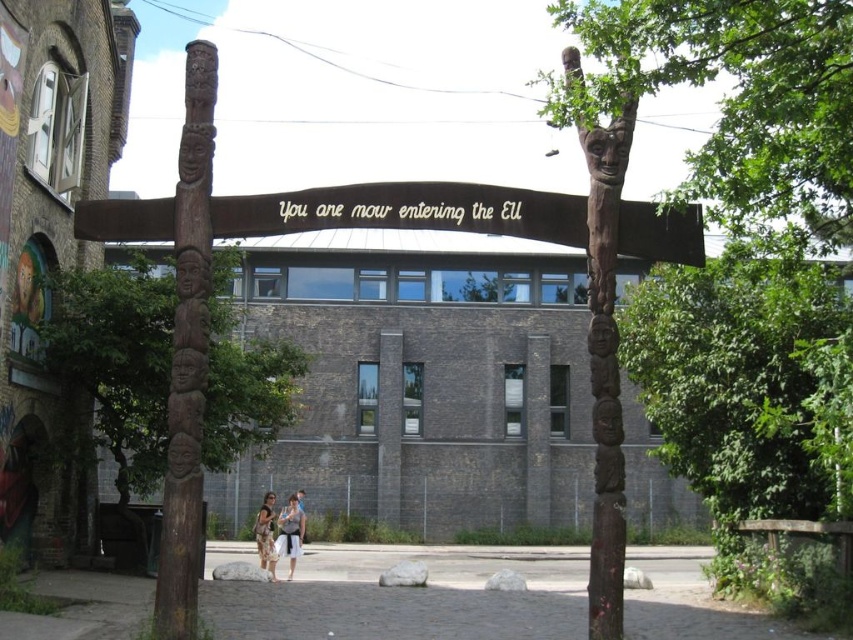
Based on the scene description, where is the wooden totem pole at center located in terms of coordinates?

The wooden totem pole at center is located at coordinates point (605, 368).

You are standing in front of the wooden archway and notice both the wooden totem pole at center and the floral dress at center. Which object is taller?

The wooden totem pole at center is much taller than the floral dress at center.

You are standing in front of the wooden archway and want to locate the point at coordinates (405,211). According to the scene description, where exactly would this point be located?

The point at coordinates (405,211) is located on the brown wooden sign at center.